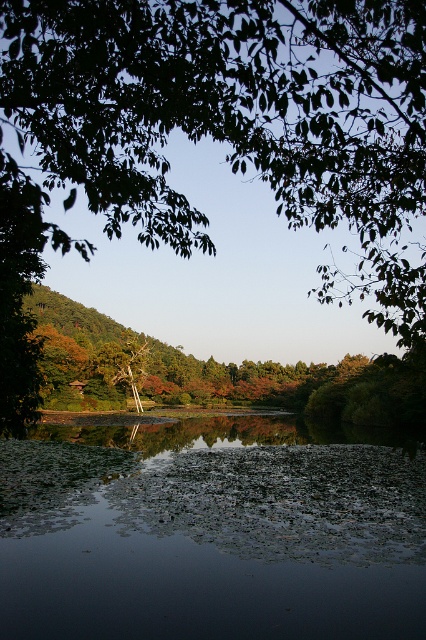
Question: Which object is farther from the camera taking this photo?

Choices:
 (A) green leafy river at center
 (B) smooth brown tree trunk at center

Answer: (B)

Question: Does green leafy river at center have a lesser width compared to smooth brown tree trunk at center?

Choices:
 (A) yes
 (B) no

Answer: (B)

Question: Which point is closer to the camera?

Choices:
 (A) green leafy tree at upper center
 (B) smooth brown tree trunk at center
 (C) green leafy river at center

Answer: (A)

Question: Is green leafy tree at upper center below smooth brown tree trunk at center?

Choices:
 (A) no
 (B) yes

Answer: (A)

Question: Does green leafy tree at upper center have a lesser width compared to green leafy river at center?

Choices:
 (A) yes
 (B) no

Answer: (B)

Question: Which object appears farthest from the camera in this image?

Choices:
 (A) green leafy tree at upper center
 (B) green leafy river at center
 (C) smooth brown tree trunk at center

Answer: (C)